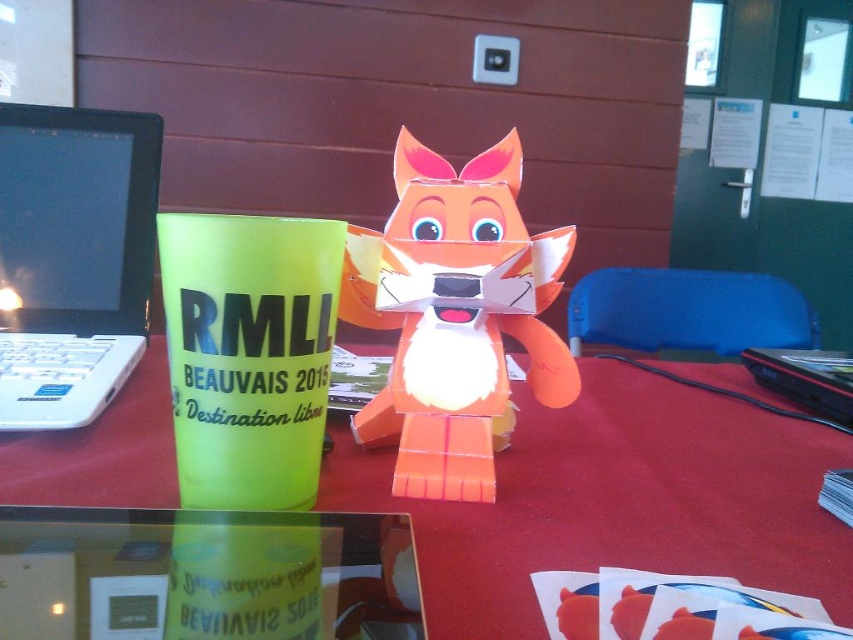
Consider the image. Between orange cardboard fox at center and blue plastic chair at center, which one appears on the right side from the viewer's perspective?

blue plastic chair at center

Between point (563, 228) and point (613, 321), which one is positioned behind?

The point (613, 321) is behind.

You are a GUI agent. You are given a task and a screenshot of the screen. Output one action in this format:
    pyautogui.click(x=<x>, y=<y>)
    Task: Click on the orange cardboard fox at center
    
    Given the screenshot: What is the action you would take?
    pyautogui.click(x=454, y=314)

Who is more distant from viewer, (525, 326) or (39, 410)?

Point (39, 410)

Between point (505, 180) and point (3, 406), which one is positioned in front?

Positioned in front is point (505, 180).

Where is `orange cardboard fox at center`? The width and height of the screenshot is (853, 640). orange cardboard fox at center is located at coordinates (454, 314).

Does white plastic laptop at left lie behind blue plastic chair at center?

No, white plastic laptop at left is in front of blue plastic chair at center.

Which is behind, point (51, 252) or point (567, 307)?

Positioned behind is point (567, 307).

The height and width of the screenshot is (640, 853). I want to click on white plastic laptop at left, so click(73, 259).